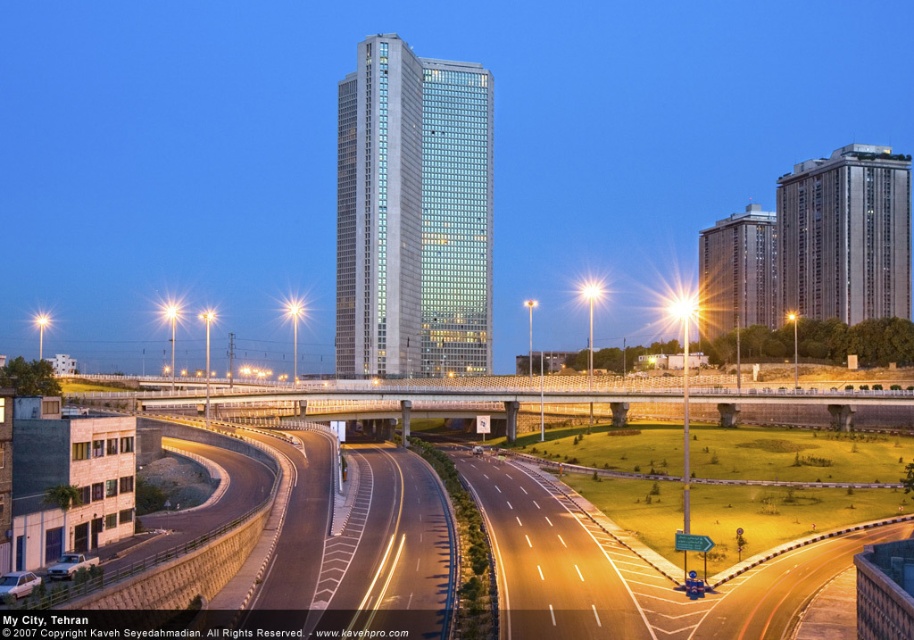
You are an architect evaluating the city layout. Based on the scene, which of the two buildings, the glassy concrete skyscraper at center or the sleek silver building at upper right, has a larger footprint in terms of width?

The glassy concrete skyscraper at center might be wider than sleek silver building at upper right, so it likely has a larger footprint in terms of width.

In the scene shown: You are a drone operator who needs to fly a drone from your current position to the glassy concrete skyscraper at center. The drone has a maximum flight range of 200 meters. Based on the scene, can the drone reach the skyscraper?

The distance between the glassy concrete skyscraper at center and the camera is 186.79 meters, which is within the drone operator maximum flight range of 200 meters. The drone can reach the skyscraper.

You are a city planner analyzing this urban layout. Which of the two buildings, the glassy concrete skyscraper at center or the sleek silver building at upper right, would require more space for its foundation based on their sizes?

The sleek silver building at upper right requires more space for its foundation since it is larger than the glassy concrete skyscraper at center.